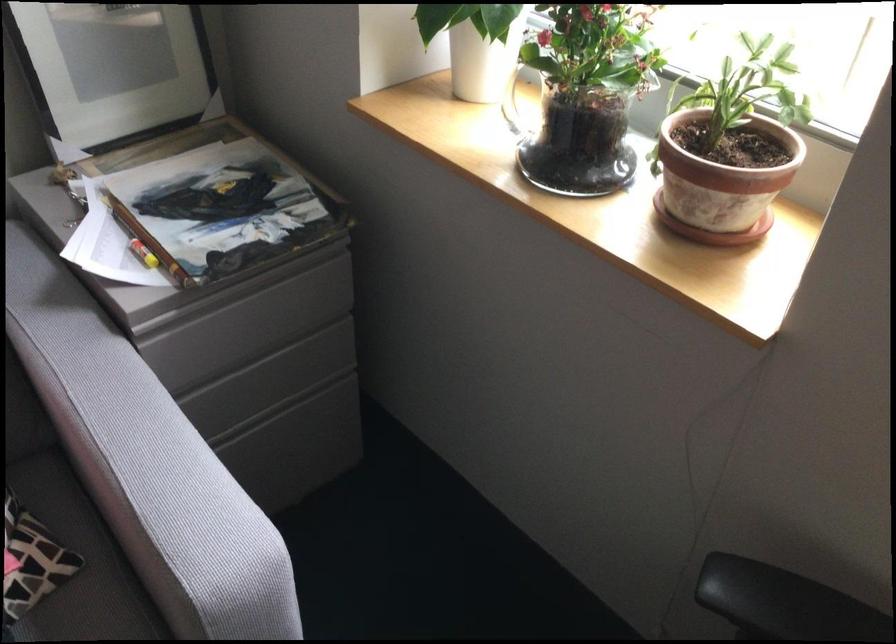
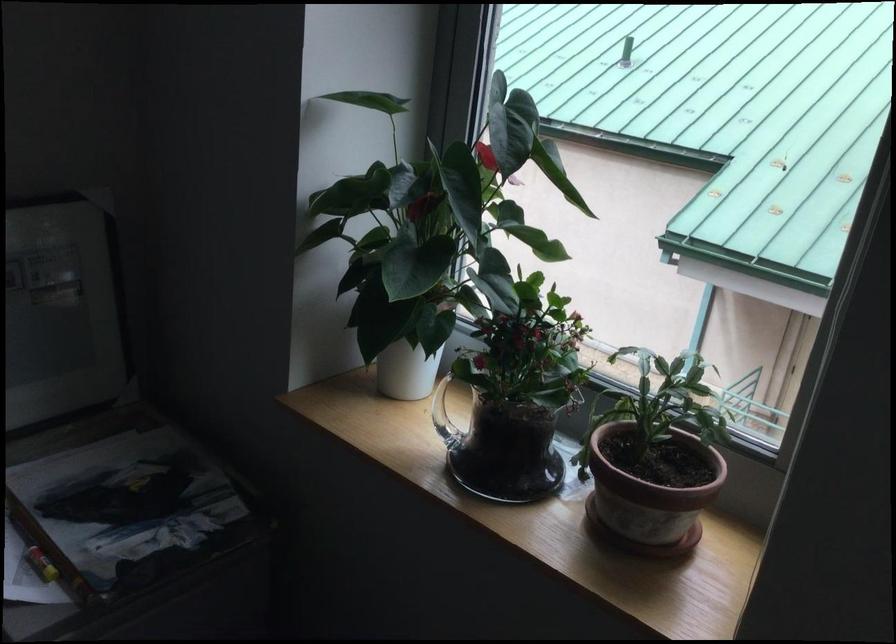
Where in the second image is the point corresponding to point 141,245 from the first image?

(40, 564)